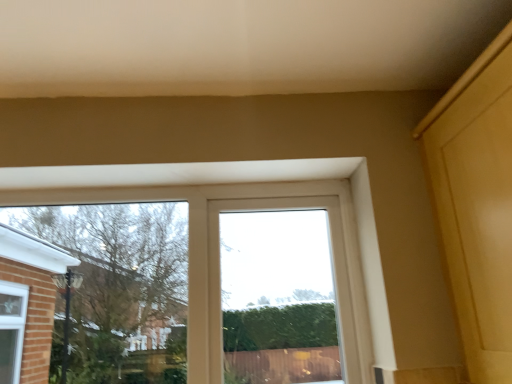
This screenshot has height=384, width=512. Describe the element at coordinates (12, 329) in the screenshot. I see `clear glass window at lower left` at that location.

The image size is (512, 384). I want to click on clear glass window at lower left, so click(12, 329).

The width and height of the screenshot is (512, 384). I want to click on clear glass window at lower left, so click(x=12, y=329).